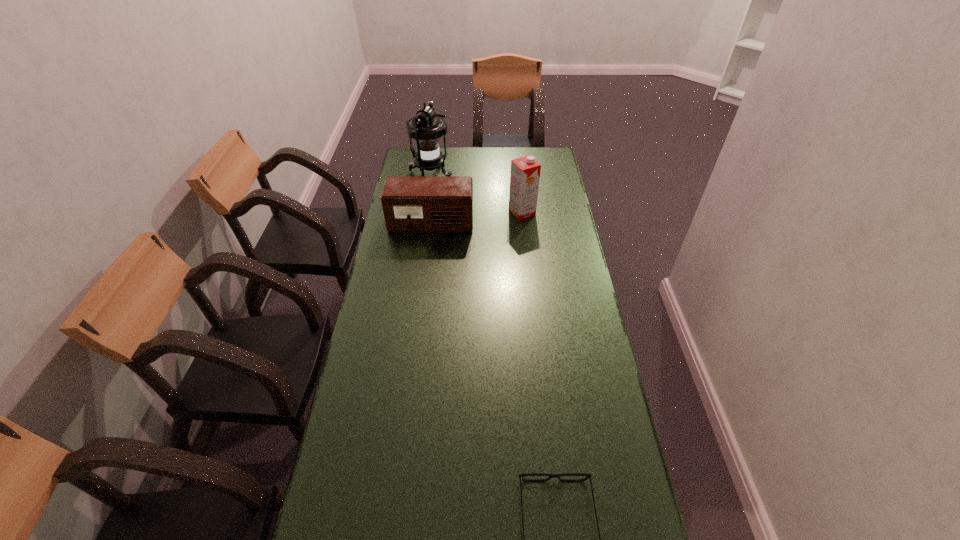
Where is `object that is at the right edge`? The image size is (960, 540). object that is at the right edge is located at coordinates (x=525, y=171).

Identify the location of object positioned at the far left corner. (427, 127).

Where is `vacant area at the far edge of the desktop`? Image resolution: width=960 pixels, height=540 pixels. vacant area at the far edge of the desktop is located at coordinates (483, 165).

This screenshot has height=540, width=960. In the image, there is a desktop. What are the coordinates of `free space at the left edge` in the screenshot? It's located at (355, 384).

Identify the location of free location at the right edge. (554, 231).

At what (x,y) coordinates should I click in order to perform the action: click on free space at the far right corner of the desktop. Please return your answer as a coordinate pair (x, y). This screenshot has width=960, height=540. Looking at the image, I should click on (540, 153).

You are a GUI agent. You are given a task and a screenshot of the screen. Output one action in this format:
    pyautogui.click(x=<x>, y=<y>)
    Task: Click on the free space between the second shortest object and the carton
    The width and height of the screenshot is (960, 540).
    Given the screenshot: What is the action you would take?
    pyautogui.click(x=476, y=218)

Choose which object is the third nearest neighbor to the third tallest object. Please provide its 2D coordinates. Your answer should be formatted as a tuple, i.e. [(x, y)], where the tuple contains the x and y coordinates of a point satisfying the conditions above.

[(521, 476)]

Where is `the third closest object to the radio receiver`? The width and height of the screenshot is (960, 540). the third closest object to the radio receiver is located at coordinates (521, 476).